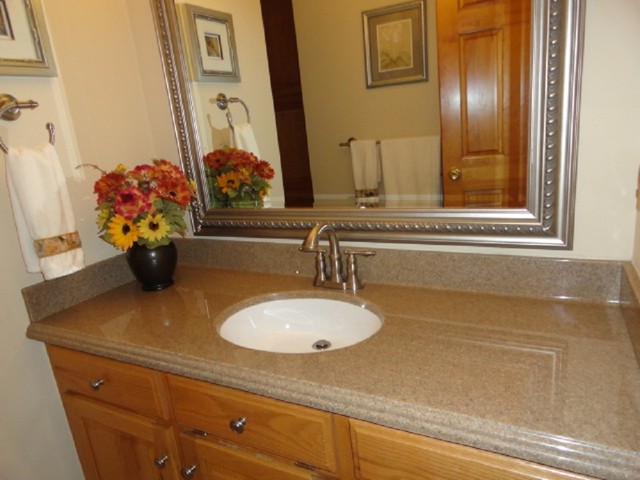
Locate an element on the screen. This screenshot has height=480, width=640. sliver frame is located at coordinates (566, 30).